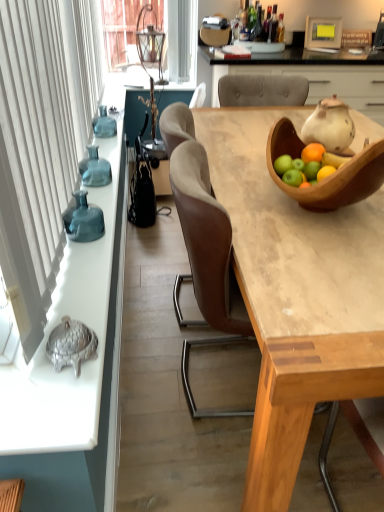
Locate an element on the screen. free space in front of teal glass vase at left, which is counted as the second vase, starting from the back is located at coordinates (87, 257).